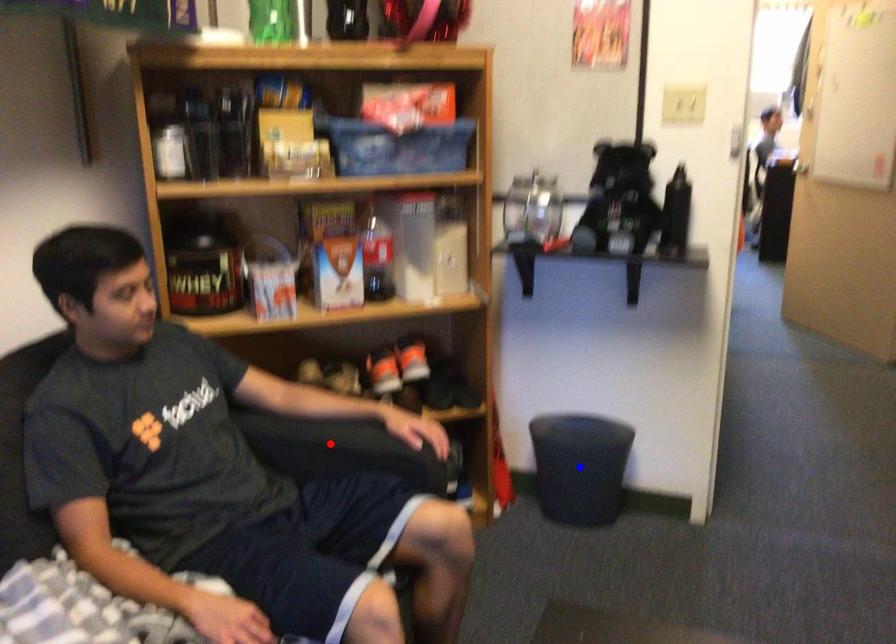
Question: Two points are marked on the image. Which point is closer to the camera?

Choices:
 (A) Blue point is closer.
 (B) Red point is closer.

Answer: (B)